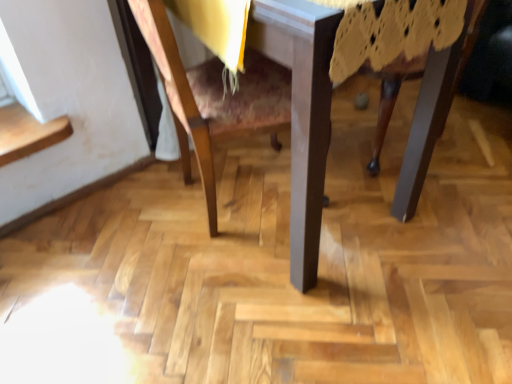
The width and height of the screenshot is (512, 384). I want to click on vacant space situated on the left part of wooden table at center, so click(97, 243).